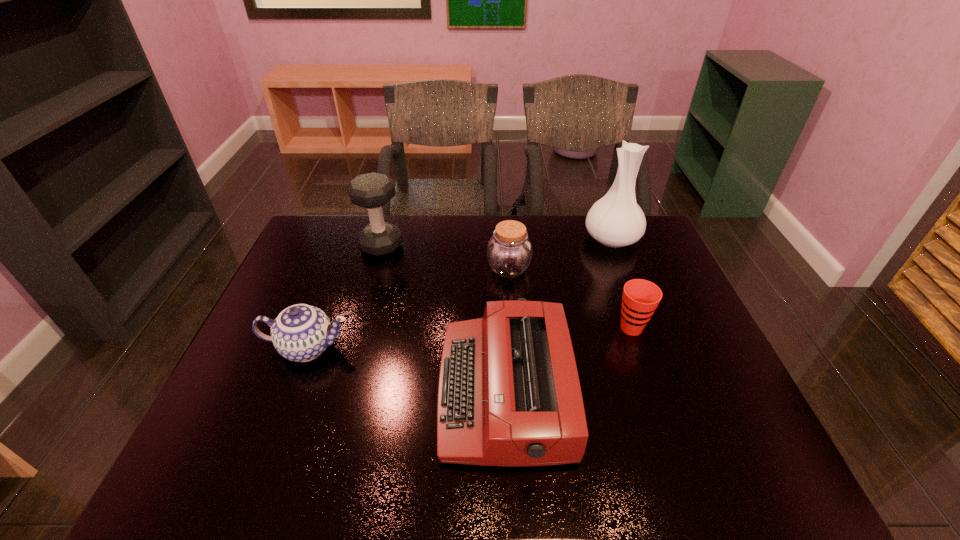
This screenshot has height=540, width=960. What are the coordinates of `free spot between the jar and the dumbbell` in the screenshot? It's located at (445, 257).

The width and height of the screenshot is (960, 540). Identify the location of unoccupied area between the jar and the chinaware. (408, 308).

Where is `free spot between the cup and the fifth shortest object`? free spot between the cup and the fifth shortest object is located at coordinates (506, 287).

What are the coordinates of `free spot between the jar and the second tallest object` in the screenshot? It's located at (445, 257).

I want to click on unoccupied area between the dumbbell and the typewriter, so click(x=443, y=319).

Locate an element on the screen. Image resolution: width=960 pixels, height=540 pixels. vacant space that's between the cup and the jar is located at coordinates (570, 299).

Find the location of `object that is the third closest one to the chinaware`. object that is the third closest one to the chinaware is located at coordinates (509, 252).

Identify which object is the nearest to the jar. Please provide its 2D coordinates. Your answer should be formatted as a tuple, i.e. [(x, y)], where the tuple contains the x and y coordinates of a point satisfying the conditions above.

[(509, 394)]

Locate an element on the screen. vacant area in the image that satisfies the following two spatial constraints: 1. on the back side of the fifth shortest object; 2. on the right side of the tallest object is located at coordinates (383, 239).

Where is `vacant region that satisfies the following two spatial constraints: 1. on the front side of the jar; 2. at the spout of the chinaware`? The image size is (960, 540). vacant region that satisfies the following two spatial constraints: 1. on the front side of the jar; 2. at the spout of the chinaware is located at coordinates (515, 348).